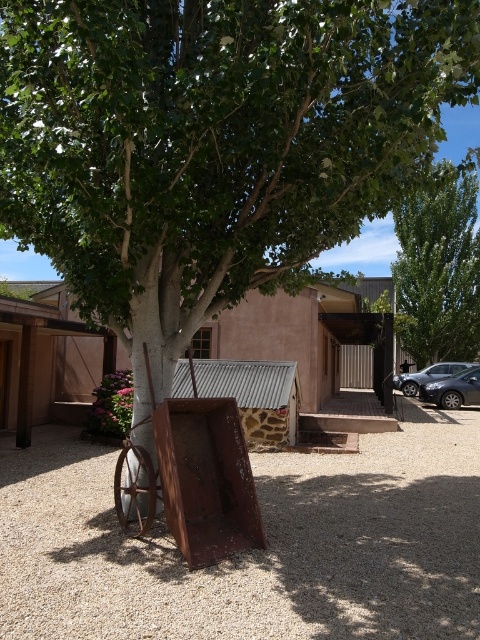
How much distance is there between rusty metal wagon at center and shiny metallic car at lower right?

rusty metal wagon at center is 14.81 meters from shiny metallic car at lower right.

Does rusty metal wagon at center appear under shiny metallic car at lower right?

No.

Is point (251, 531) positioned after point (428, 368)?

That is False.

Where is `rusty metal wagon at center`? Image resolution: width=480 pixels, height=640 pixels. rusty metal wagon at center is located at coordinates (191, 476).

Between rusty metal wagon at center and green leafy tree at upper right, which one appears on the right side from the viewer's perspective?

Positioned to the right is green leafy tree at upper right.

Is point (231, 529) positioned in front of point (424, 240)?

Yes, point (231, 529) is closer to viewer.

Image resolution: width=480 pixels, height=640 pixels. What do you see at coordinates (191, 476) in the screenshot? I see `rusty metal wagon at center` at bounding box center [191, 476].

I want to click on rusty metal wagon at center, so click(191, 476).

Can you confirm if rusty metal wagon at center is positioned above satin black sedan at lower right?

Correct, rusty metal wagon at center is located above satin black sedan at lower right.

Is point (168, 397) in front of point (471, 376)?

Yes, it is in front of point (471, 376).

Measure the distance between point [188,509] and camera.

The distance of point [188,509] from camera is 16.83 feet.

The height and width of the screenshot is (640, 480). What are the coordinates of `rusty metal wagon at center` in the screenshot? It's located at (191, 476).